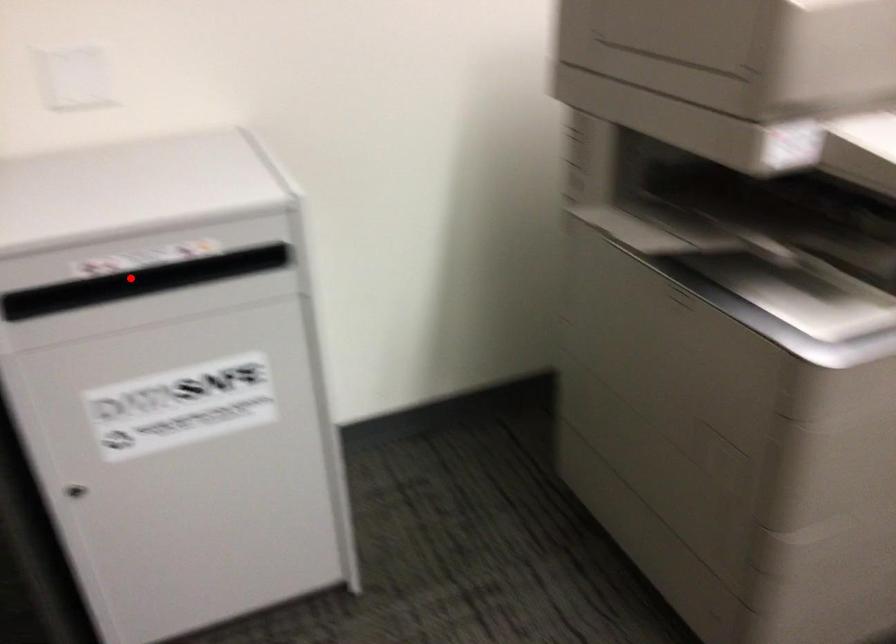
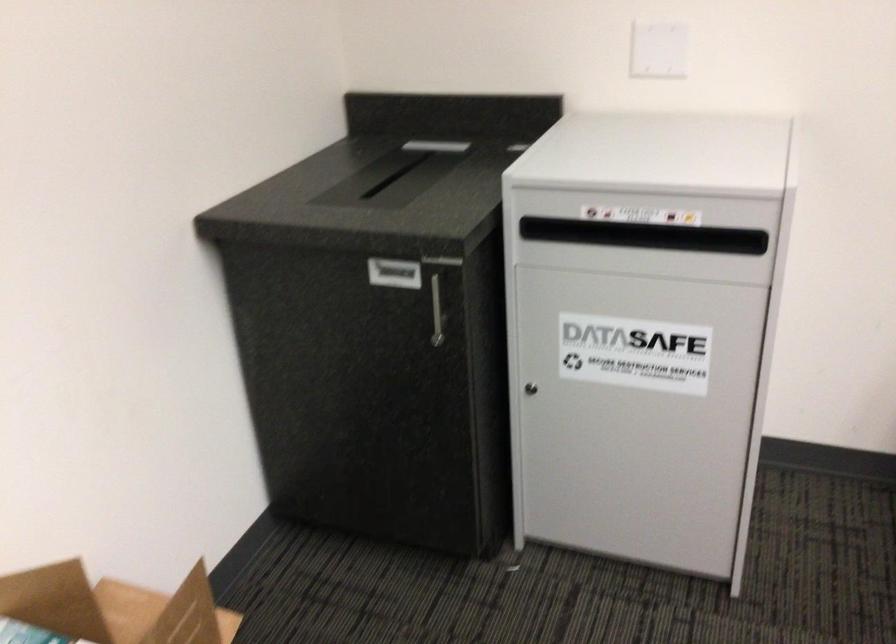
Where in the second image is the point corresponding to the highlighted location from the first image?

(644, 236)